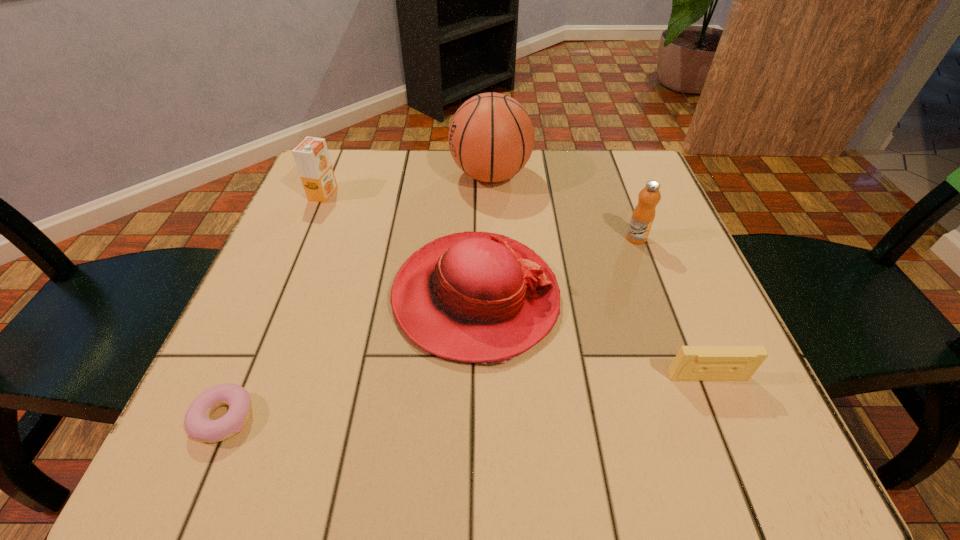
This screenshot has width=960, height=540. In order to click on object that is the third closest to the left orange juice in this screenshot , I will do `click(198, 424)`.

The width and height of the screenshot is (960, 540). Identify the location of the second closest object to the shortest object. (311, 155).